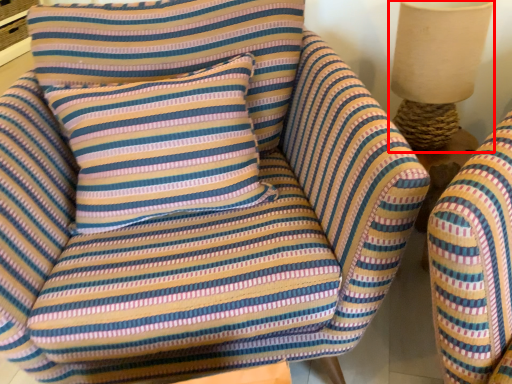
Question: Where is table lamp (annotated by the red box) located in relation to pillow in the image?

Choices:
 (A) right
 (B) left

Answer: (A)